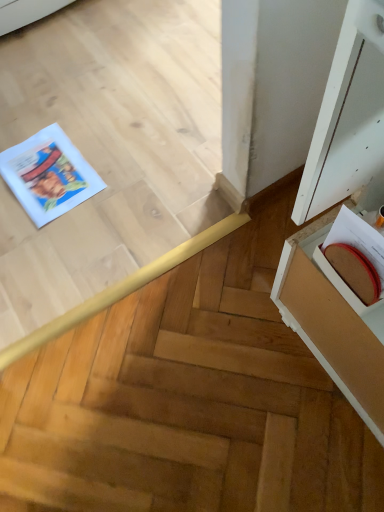
Where is `white wood cabinet at right`? Image resolution: width=384 pixels, height=512 pixels. white wood cabinet at right is located at coordinates pyautogui.click(x=349, y=120).

Image resolution: width=384 pixels, height=512 pixels. Describe the element at coordinates (359, 252) in the screenshot. I see `matte brown book at right` at that location.

Where is `white paper comic book at left`? This screenshot has width=384, height=512. white paper comic book at left is located at coordinates (48, 175).

From the image's perspective, which is above, matte brown book at right or white paper comic book at left?

white paper comic book at left appears higher in the image.

Can you confirm if matte brown book at right is thinner than white paper comic book at left?

Indeed, matte brown book at right has a lesser width compared to white paper comic book at left.

Is matte brown book at right in contact with white paper comic book at left?

No, matte brown book at right is not making contact with white paper comic book at left.

Who is taller, white wood cabinet at right or white paper comic book at left?

white wood cabinet at right is taller.

From a real-world perspective, which object stands above the other?

white wood cabinet at right.

Does white wood cabinet at right turn towards white paper comic book at left?

No, white wood cabinet at right is not facing towards white paper comic book at left.

The width and height of the screenshot is (384, 512). Identify the location of comic book located on the left of white wood cabinet at right. (48, 175).

Locate an element on the screen. comic book that is behind the white wood cabinet at right is located at coordinates (48, 175).

Is white paper comic book at left taller than white wood cabinet at right?

Incorrect, the height of white paper comic book at left is not larger of that of white wood cabinet at right.

Considering the positions of objects white paper comic book at left and white wood cabinet at right in the image provided, who is in front, white paper comic book at left or white wood cabinet at right?

white wood cabinet at right is more forward.

Which is correct: white paper comic book at left is inside white wood cabinet at right, or outside of it?

white paper comic book at left exists outside the volume of white wood cabinet at right.

Find the location of a particular element. This screenshot has height=512, width=384. cabinetry below the matte brown book at right (from the image's perspective) is located at coordinates (349, 120).

Is white wood cabinet at right not near matte brown book at right?

No, white wood cabinet at right is in close proximity to matte brown book at right.

Does white wood cabinet at right have a lesser width compared to matte brown book at right?

Incorrect, the width of white wood cabinet at right is not less than that of matte brown book at right.

Is white wood cabinet at right situated inside matte brown book at right or outside?

white wood cabinet at right is not inside matte brown book at right, it's outside.

Which is more to the left, matte brown book at right or white wood cabinet at right?

From the viewer's perspective, matte brown book at right appears more on the left side.

Does matte brown book at right have a lesser height compared to white wood cabinet at right?

Indeed, matte brown book at right has a lesser height compared to white wood cabinet at right.

In the image, there is a white wood cabinet at right. Identify the location of book above it (from the image's perspective). Image resolution: width=384 pixels, height=512 pixels. (359, 252).

Considering the relative positions of white paper comic book at left and matte brown book at right in the image provided, is white paper comic book at left in front of matte brown book at right?

No, white paper comic book at left is further to the viewer.

The height and width of the screenshot is (512, 384). Find the location of `book in front of the white paper comic book at left`. book in front of the white paper comic book at left is located at coordinates (359, 252).

Is matte brown book at right located within white paper comic book at left?

No.

Locate an element on the screen. The height and width of the screenshot is (512, 384). comic book directly beneath the matte brown book at right (from a real-world perspective) is located at coordinates (48, 175).

Image resolution: width=384 pixels, height=512 pixels. I want to click on cabinetry in front of the white paper comic book at left, so click(x=349, y=120).

From the image, which object appears to be nearer to matte brown book at right, white paper comic book at left or white wood cabinet at right?

white wood cabinet at right is positioned closer to the anchor matte brown book at right.

Looking at the image, which one is located further to white paper comic book at left, white wood cabinet at right or matte brown book at right?

Among the two, matte brown book at right is located further to white paper comic book at left.

Which object lies nearer to the anchor point matte brown book at right, white wood cabinet at right or white paper comic book at left?

white wood cabinet at right.

When comparing their distances from white wood cabinet at right, does matte brown book at right or white paper comic book at left seem closer?

The object closer to white wood cabinet at right is matte brown book at right.

Based on their spatial positions, is matte brown book at right or white wood cabinet at right further from white paper comic book at left?

Result: The object further to white paper comic book at left is matte brown book at right.

Estimate the real-world distances between objects in this image. Which object is closer to white wood cabinet at right, white paper comic book at left or matte brown book at right?

Based on the image, matte brown book at right appears to be nearer to white wood cabinet at right.

Locate an element on the screen. The width and height of the screenshot is (384, 512). book between white wood cabinet at right and white paper comic book at left in the front-back direction is located at coordinates (359, 252).